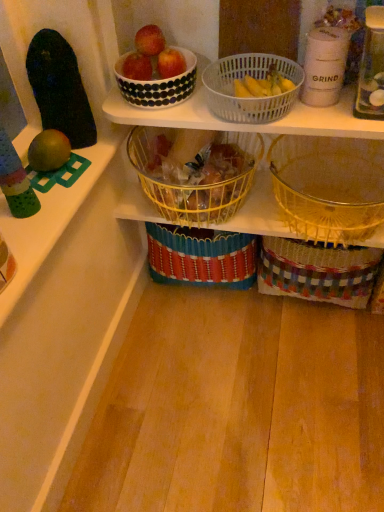
Where is `vacant area that is in front of shiny red apple at upper center, the second apple when ordered from left to right`? This screenshot has height=512, width=384. vacant area that is in front of shiny red apple at upper center, the second apple when ordered from left to right is located at coordinates (150, 70).